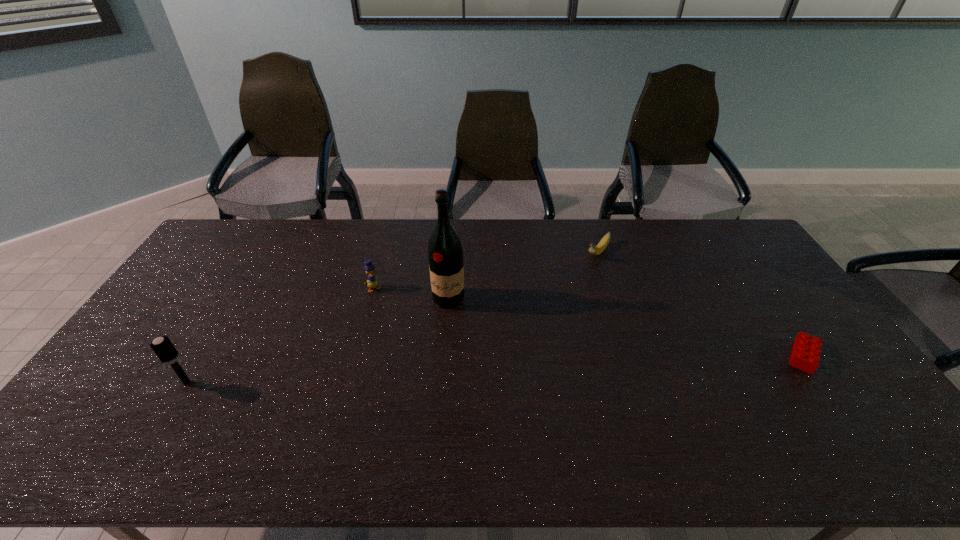
Where is `free space located at the stem of the banana`? Image resolution: width=960 pixels, height=540 pixels. free space located at the stem of the banana is located at coordinates (536, 325).

You are a GUI agent. You are given a task and a screenshot of the screen. Output one action in this format:
    pyautogui.click(x=<x>, y=<y>)
    Task: Click on the object present at the far edge
    Image resolution: width=960 pixels, height=540 pixels.
    Given the screenshot: What is the action you would take?
    pyautogui.click(x=595, y=250)

Locate an element on the screen. object present at the right edge is located at coordinates (806, 351).

Identify the location of vacant space at the far edge of the desktop. This screenshot has width=960, height=540. (578, 252).

In the image, there is a desktop. Identify the location of vacant space at the near edge. (218, 397).

Locate an element on the screen. The width and height of the screenshot is (960, 540). free space at the left edge of the desktop is located at coordinates (230, 269).

Where is `free space at the far left corner of the desktop`? The height and width of the screenshot is (540, 960). free space at the far left corner of the desktop is located at coordinates (229, 247).

Where is `empty location between the farthest object and the tallest object`? empty location between the farthest object and the tallest object is located at coordinates (523, 276).

Find the location of a particular element. blank region between the hairbrush and the Lego is located at coordinates (495, 369).

Find the location of a particular element. This screenshot has width=960, height=540. vacant area that lies between the third tallest object and the tallest object is located at coordinates 411,294.